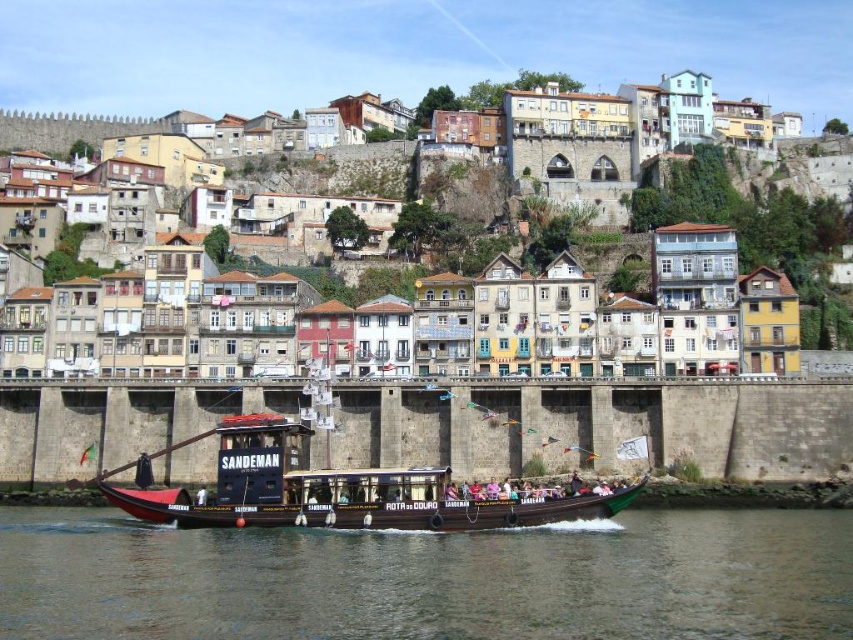
This screenshot has width=853, height=640. What do you see at coordinates (428, 579) in the screenshot? I see `brown wooden boat at center` at bounding box center [428, 579].

Does brown wooden boat at center have a smaller size compared to wooden boat at center?

Correct, brown wooden boat at center occupies less space than wooden boat at center.

The width and height of the screenshot is (853, 640). What do you see at coordinates (428, 579) in the screenshot? I see `brown wooden boat at center` at bounding box center [428, 579].

The image size is (853, 640). What are the coordinates of `brown wooden boat at center` in the screenshot? It's located at (428, 579).

Looking at this image, does brown wooden boat at center have a lesser width compared to multicolored wooden houses at center?

Yes, brown wooden boat at center is thinner than multicolored wooden houses at center.

At what (x,y) coordinates should I click in order to perform the action: click on brown wooden boat at center. Please return your answer as a coordinate pair (x, y). Looking at the image, I should click on (428, 579).

Which of these two, multicolored wooden houses at center or wooden boat at center, stands shorter?

Standing shorter between the two is wooden boat at center.

Does multicolored wooden houses at center come behind wooden boat at center?

Yes, it is behind wooden boat at center.

Who is more distant from viewer, (672, 172) or (374, 508)?

The point (672, 172) is behind.

Identify the location of multicolored wooden houses at center. The width and height of the screenshot is (853, 640). (753, 227).